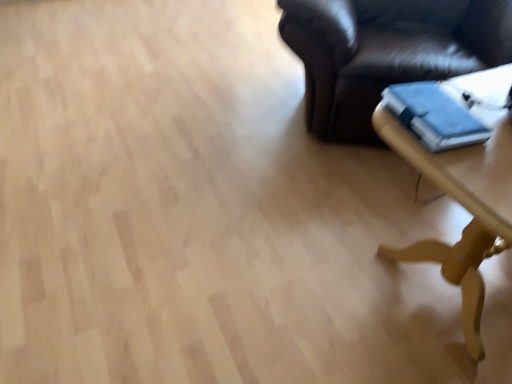
Question: Based on their positions, is light brown wooden table at lower right located to the left or right of blue matte book at right?

Choices:
 (A) left
 (B) right

Answer: (B)

Question: Relative to blue matte book at right, is light brown wooden table at lower right in front or behind?

Choices:
 (A) behind
 (B) front

Answer: (B)

Question: Is point (509, 77) positioned closer to the camera than point (408, 114)?

Choices:
 (A) farther
 (B) closer

Answer: (A)

Question: Considering the relative positions of blue matte book at right and light brown wooden table at lower right in the image provided, is blue matte book at right to the left or to the right of light brown wooden table at lower right?

Choices:
 (A) right
 (B) left

Answer: (B)

Question: Is blue matte book at right taller or shorter than light brown wooden table at lower right?

Choices:
 (A) short
 (B) tall

Answer: (A)

Question: In terms of size, does blue matte book at right appear bigger or smaller than light brown wooden table at lower right?

Choices:
 (A) big
 (B) small

Answer: (B)

Question: From a real-world perspective, is blue matte book at right physically located above or below light brown wooden table at lower right?

Choices:
 (A) above
 (B) below

Answer: (A)